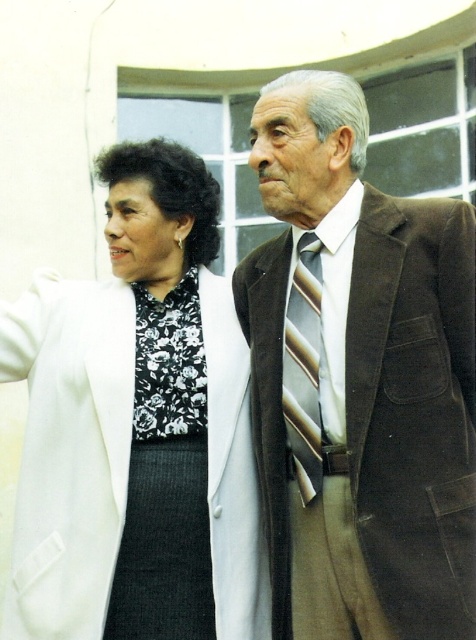
Question: Does suede brown suit at right appear on the left side of striped silk tie at center?

Choices:
 (A) yes
 (B) no

Answer: (B)

Question: Which is farther from the white textured coat at center?

Choices:
 (A) striped silk tie at center
 (B) black floral fabric dress at center
 (C) suede brown suit at right

Answer: (A)

Question: Observing the image, what is the correct spatial positioning of black floral fabric dress at center in reference to striped silk tie at center?

Choices:
 (A) left
 (B) right

Answer: (A)

Question: Is the position of suede brown suit at right less distant than that of striped silk tie at center?

Choices:
 (A) no
 (B) yes

Answer: (B)

Question: Which of the following is the closest to the observer?

Choices:
 (A) (304, 454)
 (B) (135, 577)
 (C) (180, 508)

Answer: (A)

Question: Which point is closer to the camera taking this photo?

Choices:
 (A) (336, 589)
 (B) (128, 492)
 (C) (176, 305)
 (D) (283, 369)

Answer: (A)